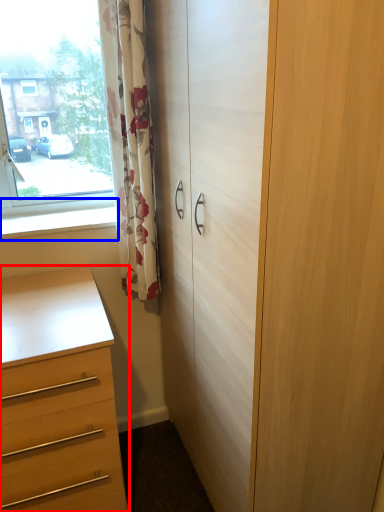
Question: Which object appears farthest to the camera in this image, chest of drawers (highlighted by a red box) or window sill (highlighted by a blue box)?

Choices:
 (A) chest of drawers
 (B) window sill

Answer: (B)